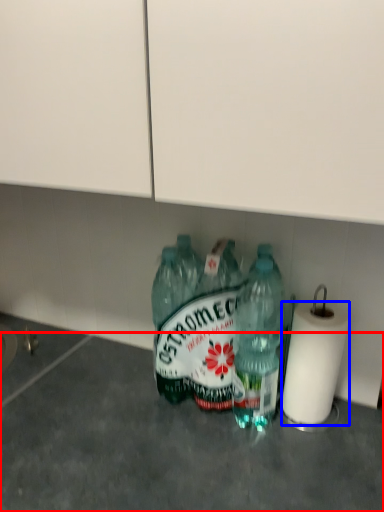
Question: Which of the following is the farthest to the observer, concrete (highlighted by a red box) or paper towel (highlighted by a blue box)?

Choices:
 (A) concrete
 (B) paper towel

Answer: (B)